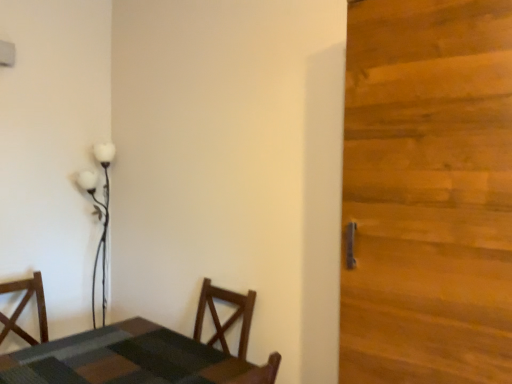
Question: From the image's perspective, is wooden door at right located above or below white glossy floor lamp at upper left?

Choices:
 (A) above
 (B) below

Answer: (A)

Question: Do you think wooden door at right is within white glossy floor lamp at upper left, or outside of it?

Choices:
 (A) outside
 (B) inside

Answer: (A)

Question: Which object is positioned closest to the white glossy floor lamp at upper left?

Choices:
 (A) wooden door at right
 (B) textured wood table at lower left

Answer: (B)

Question: Which of these objects is positioned closest to the textured wood table at lower left?

Choices:
 (A) white glossy floor lamp at upper left
 (B) wooden door at right

Answer: (B)